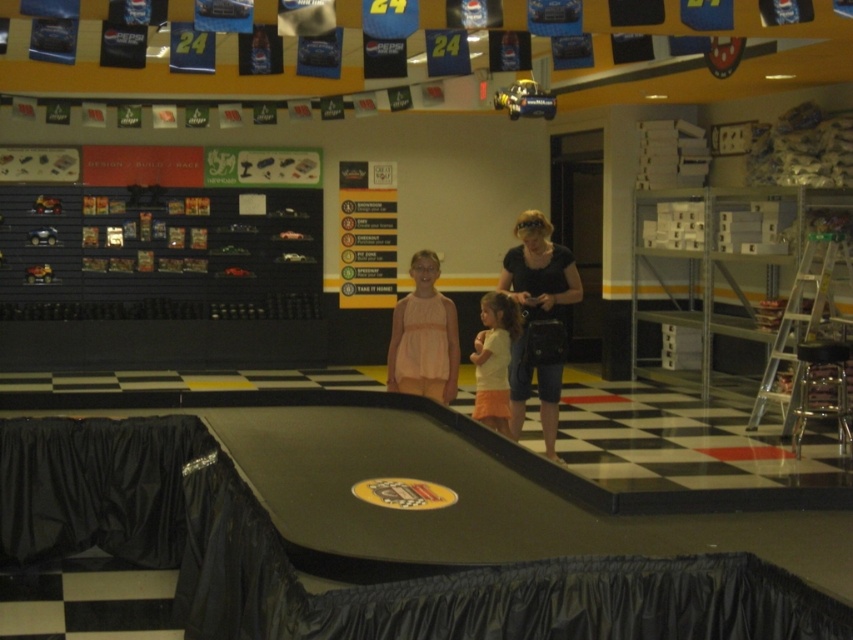
Question: Is black fabric purse at center in front of light yellow t-shirt at center?

Choices:
 (A) no
 (B) yes

Answer: (A)

Question: Which of the following is the farthest from the observer?

Choices:
 (A) pink fabric dress at center
 (B) black fabric purse at center
 (C) light yellow t-shirt at center

Answer: (B)

Question: Among these objects, which one is farthest from the camera?

Choices:
 (A) light yellow t-shirt at center
 (B) pink fabric dress at center
 (C) black fabric purse at center

Answer: (C)

Question: Which is nearer to the light yellow t-shirt at center?

Choices:
 (A) black fabric purse at center
 (B) pink fabric dress at center

Answer: (A)

Question: Is the position of pink fabric dress at center less distant than that of light yellow t-shirt at center?

Choices:
 (A) yes
 (B) no

Answer: (A)

Question: Can you confirm if black fabric purse at center is positioned above pink fabric dress at center?

Choices:
 (A) yes
 (B) no

Answer: (B)